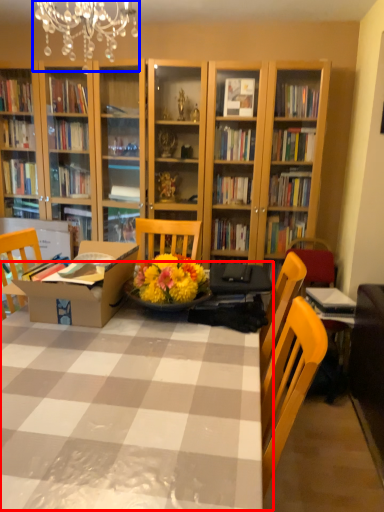
Question: Among these objects, which one is nearest to the camera, table (highlighted by a red box) or light fixture (highlighted by a blue box)?

Choices:
 (A) table
 (B) light fixture

Answer: (A)